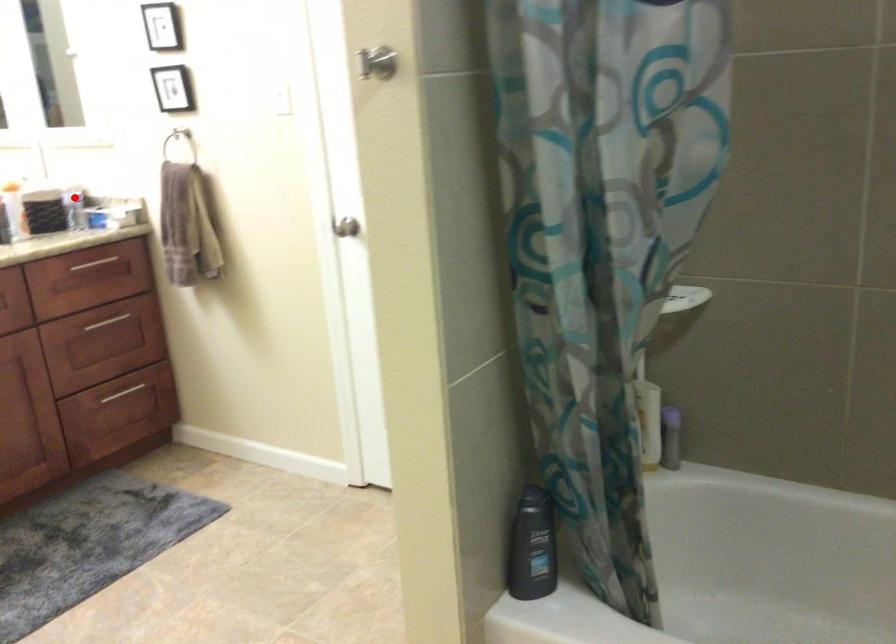
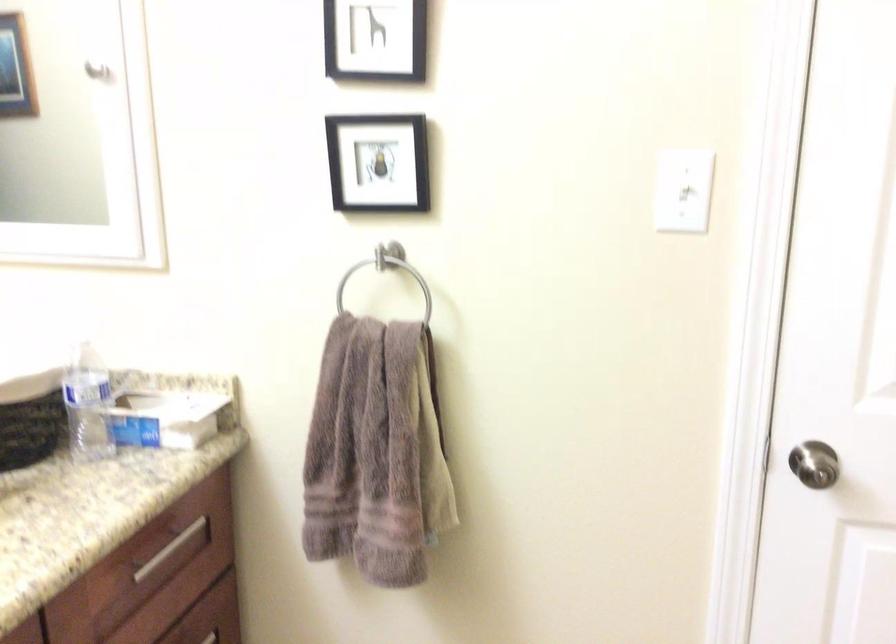
In the second image, find the point that corresponds to the highlighted location in the first image.

(88, 404)